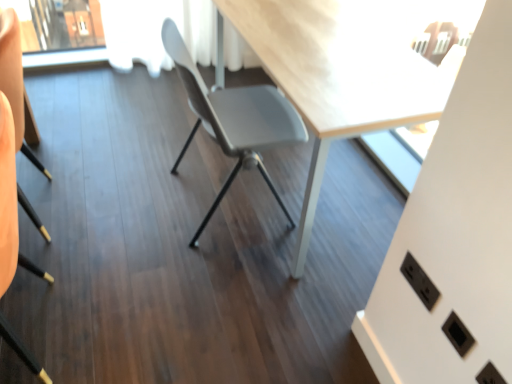
Measure the distance between point (285,111) and camera.

1.85 meters.

You are a GUI agent. You are given a task and a screenshot of the screen. Output one action in this format:
    pyautogui.click(x=<x>, y=<y>)
    Task: Click on the black matte chair at lower left, which appears as the second chair when viewed from the right
    The width and height of the screenshot is (512, 384).
    Given the screenshot: What is the action you would take?
    pyautogui.click(x=12, y=70)

Is black plastic electric outlet at lower right next to matte gray chair at center, the 2th chair viewed from the left?

black plastic electric outlet at lower right is not next to matte gray chair at center, the 2th chair viewed from the left, and they're not touching.

Which of these two, black plastic electric outlet at lower right or matte gray chair at center, the 2th chair viewed from the left, is wider?

With larger width is matte gray chair at center, the 2th chair viewed from the left.

Considering the relative positions of black plastic electric outlet at lower right and matte gray chair at center, the 2th chair viewed from the left, in the image provided, is black plastic electric outlet at lower right to the left or to the right of matte gray chair at center, the 2th chair viewed from the left,?

From the image, it's evident that black plastic electric outlet at lower right is to the right of matte gray chair at center, the 2th chair viewed from the left.

From the image's perspective, which one is positioned lower, black plastic electric outlet at lower right or matte gray chair at center, the 2th chair viewed from the left?

black plastic electric outlet at lower right appears lower in the image.

From the image's perspective, which is above, matte gray chair at center, which is the first chair from right to left, or black matte chair at lower left, the 1th chair viewed from the left?

matte gray chair at center, which is the first chair from right to left, appears higher in the image.

Is black matte chair at lower left, which appears as the second chair when viewed from the right, a part of matte gray chair at center, which is the first chair from right to left?

No, black matte chair at lower left, which appears as the second chair when viewed from the right, is not a part of matte gray chair at center, which is the first chair from right to left.

In order to click on chair below the matte gray chair at center, which is the first chair from right to left (from the image's perspective) in this screenshot , I will do `click(12, 70)`.

Considering the positions of objects matte gray chair at center, which is the first chair from right to left, and black matte chair at lower left, the 1th chair viewed from the left, in the image provided, who is more to the left, matte gray chair at center, which is the first chair from right to left, or black matte chair at lower left, the 1th chair viewed from the left,?

Positioned to the left is black matte chair at lower left, the 1th chair viewed from the left.

Is black plastic electric outlet at lower right surrounding black matte chair at lower left, which appears as the second chair when viewed from the right?

That's incorrect, black matte chair at lower left, which appears as the second chair when viewed from the right, is not inside black plastic electric outlet at lower right.

Is black plastic electric outlet at lower right turned away from black matte chair at lower left, the 1th chair viewed from the left?

No, black plastic electric outlet at lower right is not facing the opposite direction of black matte chair at lower left, the 1th chair viewed from the left.

Where is `electric outlet above the black matte chair at lower left, the 1th chair viewed from the left (from a real-world perspective)`? electric outlet above the black matte chair at lower left, the 1th chair viewed from the left (from a real-world perspective) is located at coordinates (419, 281).

Is black matte chair at lower left, the 1th chair viewed from the left, oriented away from black plastic electric outlet at lower right?

That's right, black matte chair at lower left, the 1th chair viewed from the left, is facing away from black plastic electric outlet at lower right.

Can you confirm if black matte chair at lower left, which appears as the second chair when viewed from the right, is shorter than black plastic electric outlet at lower right?

In fact, black matte chair at lower left, which appears as the second chair when viewed from the right, may be taller than black plastic electric outlet at lower right.

Which is more to the right, black matte chair at lower left, which appears as the second chair when viewed from the right, or black plastic electric outlet at lower right?

Positioned to the right is black plastic electric outlet at lower right.

Could black plastic electric outlet at lower right be considered to be inside black matte chair at lower left, the 1th chair viewed from the left?

No, black matte chair at lower left, the 1th chair viewed from the left, does not contain black plastic electric outlet at lower right.

Considering the positions of objects black matte chair at lower left, which appears as the second chair when viewed from the right, and matte gray chair at center, which is the first chair from right to left, in the image provided, who is in front, black matte chair at lower left, which appears as the second chair when viewed from the right, or matte gray chair at center, which is the first chair from right to left,?

black matte chair at lower left, which appears as the second chair when viewed from the right, is closer to the camera.

Is black matte chair at lower left, which appears as the second chair when viewed from the right, not inside matte gray chair at center, which is the first chair from right to left?

Yes, black matte chair at lower left, which appears as the second chair when viewed from the right, is located beyond the bounds of matte gray chair at center, which is the first chair from right to left.

Which is more to the left, black matte chair at lower left, the 1th chair viewed from the left, or matte gray chair at center, the 2th chair viewed from the left?

From the viewer's perspective, black matte chair at lower left, the 1th chair viewed from the left, appears more on the left side.

From the image's perspective, which one is positioned lower, black matte chair at lower left, the 1th chair viewed from the left, or matte gray chair at center, which is the first chair from right to left?

black matte chair at lower left, the 1th chair viewed from the left, is shown below in the image.

Which of these two, matte gray chair at center, the 2th chair viewed from the left, or black plastic electric outlet at lower right, is thinner?

black plastic electric outlet at lower right.

Is matte gray chair at center, the 2th chair viewed from the left, oriented towards black plastic electric outlet at lower right?

No, matte gray chair at center, the 2th chair viewed from the left, is not aimed at black plastic electric outlet at lower right.

Considering the sizes of matte gray chair at center, the 2th chair viewed from the left, and black plastic electric outlet at lower right in the image, is matte gray chair at center, the 2th chair viewed from the left, taller or shorter than black plastic electric outlet at lower right?

Considering their sizes, matte gray chair at center, the 2th chair viewed from the left, has more height than black plastic electric outlet at lower right.

Measure the distance from matte gray chair at center, the 2th chair viewed from the left, to black plastic electric outlet at lower right.

matte gray chair at center, the 2th chair viewed from the left, is 35.54 inches away from black plastic electric outlet at lower right.

At what (x,y) coordinates should I click in order to perform the action: click on chair that is the 2nd object located above the black plastic electric outlet at lower right (from the image's perspective). Please return your answer as a coordinate pair (x, y). Looking at the image, I should click on (234, 119).

Where is `chair beneath the black matte chair at lower left, the 1th chair viewed from the left (from a real-world perspective)`? chair beneath the black matte chair at lower left, the 1th chair viewed from the left (from a real-world perspective) is located at coordinates tap(234, 119).

When comparing their distances from black plastic electric outlet at lower right, does matte gray chair at center, which is the first chair from right to left, or black matte chair at lower left, the 1th chair viewed from the left, seem further?

black matte chair at lower left, the 1th chair viewed from the left, is further to black plastic electric outlet at lower right.

Based on their spatial positions, is black plastic electric outlet at lower right or black matte chair at lower left, which appears as the second chair when viewed from the right, closer to matte gray chair at center, the 2th chair viewed from the left?

The object closer to matte gray chair at center, the 2th chair viewed from the left, is black matte chair at lower left, which appears as the second chair when viewed from the right.

From the image, which object appears to be farther from black matte chair at lower left, the 1th chair viewed from the left, matte gray chair at center, which is the first chair from right to left, or black plastic electric outlet at lower right?

The object further to black matte chair at lower left, the 1th chair viewed from the left, is black plastic electric outlet at lower right.

When comparing their distances from matte gray chair at center, which is the first chair from right to left, does black matte chair at lower left, which appears as the second chair when viewed from the right, or black plastic electric outlet at lower right seem closer?

black matte chair at lower left, which appears as the second chair when viewed from the right, is positioned closer to the anchor matte gray chair at center, which is the first chair from right to left.

Looking at the image, which one is located closer to black plastic electric outlet at lower right, black matte chair at lower left, which appears as the second chair when viewed from the right, or matte gray chair at center, which is the first chair from right to left?

The object closer to black plastic electric outlet at lower right is matte gray chair at center, which is the first chair from right to left.

From the image, which object appears to be farther from black matte chair at lower left, which appears as the second chair when viewed from the right, black plastic electric outlet at lower right or matte gray chair at center, which is the first chair from right to left?

black plastic electric outlet at lower right is positioned further to the anchor black matte chair at lower left, which appears as the second chair when viewed from the right.

Where is `chair between black matte chair at lower left, the 1th chair viewed from the left, and black plastic electric outlet at lower right, in the horizontal direction`? chair between black matte chair at lower left, the 1th chair viewed from the left, and black plastic electric outlet at lower right, in the horizontal direction is located at coordinates [x=234, y=119].